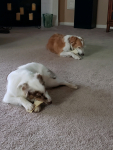
Identify the location of carpet. This screenshot has width=113, height=150. (94, 71).